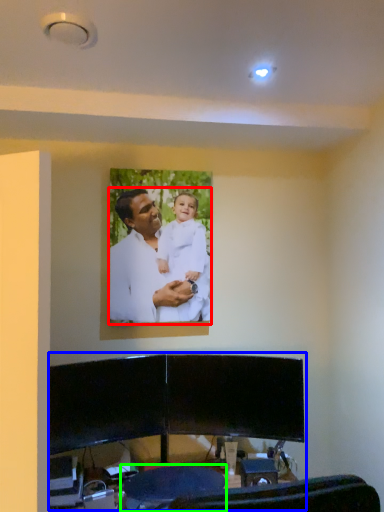
Question: Considering the real-world distances, which object is farthest from man (highlighted by a red box)? entertainment center (highlighted by a blue box) or swivel chair (highlighted by a green box)?

Choices:
 (A) entertainment center
 (B) swivel chair

Answer: (B)